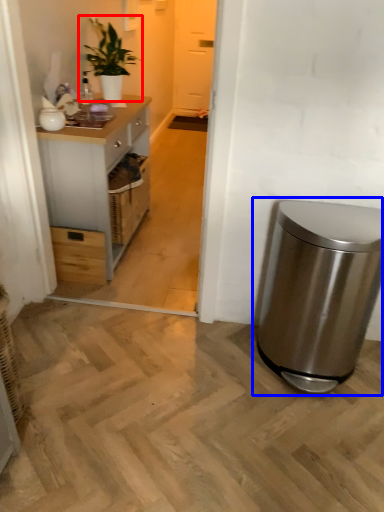
Question: Which object appears farthest to the camera in this image, houseplant (highlighted by a red box) or waste container (highlighted by a blue box)?

Choices:
 (A) houseplant
 (B) waste container

Answer: (A)